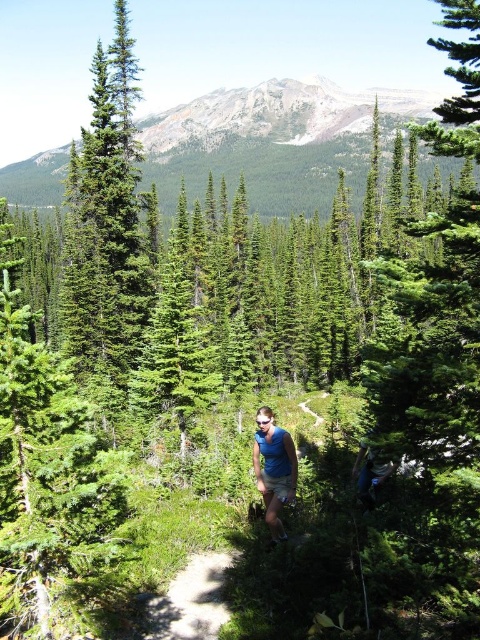
You are a hiker standing at the dirt path in the foreground of the scene. You want to reach the green textured mountain at upper center. According to the coordinates provided, in which direction should you head from your current position?

The green textured mountain at upper center is located at coordinates point (x=263, y=145). Since the coordinate system typically has the origin at the bottom left corner, the x value of 0.227 places it slightly to the right of the center horizontally, and the y value of 0.548 places it above the midpoint vertically. Therefore, you should head towards the upper right direction from your current position on the dirt path to reach the green textured mountain at upper center.

You are a hiker planning to take a photo of the dirt path at center with your camera. You notice the green fir tree at left might block your view. Based on their sizes, which object would you need to adjust your camera angle to include both in the frame?

The green fir tree at left is larger in size than the dirt path at center, so you would need to adjust your camera angle to accommodate the larger size of the green fir tree at left while still capturing the dirt path at center.

You are a hiker planning to take a photo of the green textured mountain at upper center and the green fir tree at left. Which object should you focus on first if you want both to be in sharp focus?

The green fir tree at left should be focused on first because it is closer to the camera than the green textured mountain at upper center, which is further away. By focusing on the closer object, the background object will also be in focus due to the depth of field.